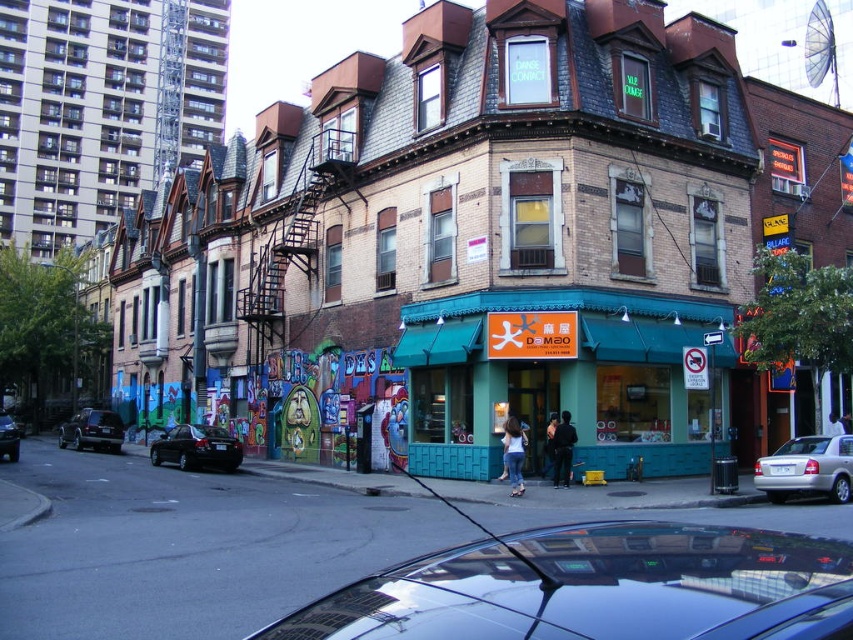
Question: Which object is the farthest from the dark blue jeans at center?

Choices:
 (A) shiny black sedan at left
 (B) black leather jacket at center
 (C) shiny black sedan at center

Answer: (A)

Question: Can you confirm if shiny black sedan at center is smaller than denim jeans at center?

Choices:
 (A) no
 (B) yes

Answer: (A)

Question: Which point is closer to the camera taking this photo?

Choices:
 (A) (804, 436)
 (B) (364, 593)
 (C) (187, 429)
 (D) (9, 435)

Answer: (B)

Question: Is shiny black sedan at center above denim jeans at center?

Choices:
 (A) no
 (B) yes

Answer: (A)

Question: Observing the image, what is the correct spatial positioning of denim jeans at center in reference to black matte car at lower left?

Choices:
 (A) left
 (B) right

Answer: (B)

Question: Which point is closer to the camera?

Choices:
 (A) black glossy car at lower center
 (B) denim jeans at center
 (C) teal brick building at center
 (D) shiny black sedan at center

Answer: (A)